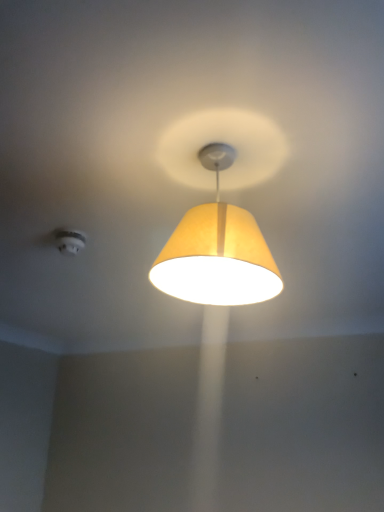
Question: From the image's perspective, is matte yellow fabric lampshade at center located above or below white plastic smoke detector at upper left?

Choices:
 (A) above
 (B) below

Answer: (A)

Question: In the image, is matte yellow fabric lampshade at center positioned in front of or behind white plastic smoke detector at upper left?

Choices:
 (A) front
 (B) behind

Answer: (A)

Question: Is matte yellow fabric lampshade at center bigger or smaller than white plastic smoke detector at upper left?

Choices:
 (A) small
 (B) big

Answer: (B)

Question: Relative to matte yellow fabric lampshade at center, is white plastic smoke detector at upper left in front or behind?

Choices:
 (A) front
 (B) behind

Answer: (B)

Question: Is white plastic smoke detector at upper left bigger or smaller than matte yellow fabric lampshade at center?

Choices:
 (A) big
 (B) small

Answer: (B)

Question: From their relative heights in the image, would you say white plastic smoke detector at upper left is taller or shorter than matte yellow fabric lampshade at center?

Choices:
 (A) short
 (B) tall

Answer: (A)

Question: In terms of width, does white plastic smoke detector at upper left look wider or thinner when compared to matte yellow fabric lampshade at center?

Choices:
 (A) thin
 (B) wide

Answer: (A)